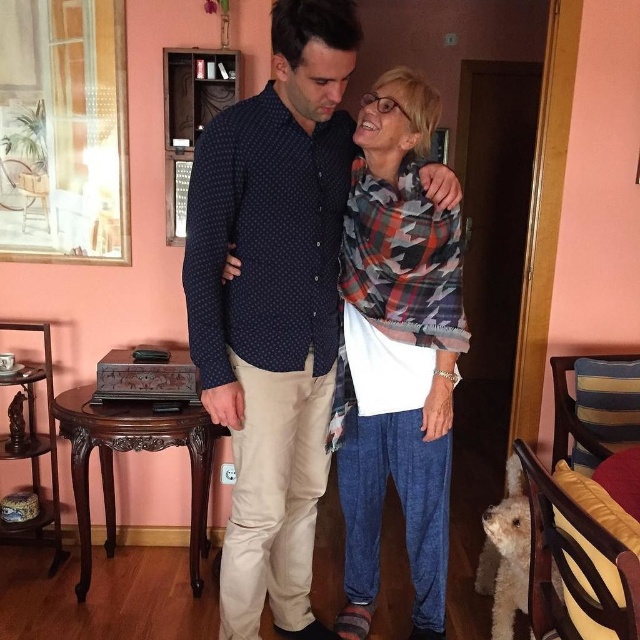
Question: Which point is farther from the camera taking this photo?

Choices:
 (A) (305, 502)
 (B) (364, 512)
 (C) (552, 573)

Answer: (B)

Question: Is polka dot shirt at center above white fluffy dog at lower right?

Choices:
 (A) yes
 (B) no

Answer: (A)

Question: Which object is positioned closest to the white fluffy dog at lower right?

Choices:
 (A) polka dot shirt at center
 (B) camo-patterned scarf at center

Answer: (B)

Question: Does polka dot shirt at center have a lesser width compared to camo-patterned scarf at center?

Choices:
 (A) no
 (B) yes

Answer: (A)

Question: Can you confirm if polka dot shirt at center is wider than white fluffy dog at lower right?

Choices:
 (A) yes
 (B) no

Answer: (A)

Question: Which point appears farthest from the camera in this image?

Choices:
 (A) (248, 257)
 (B) (497, 556)

Answer: (B)